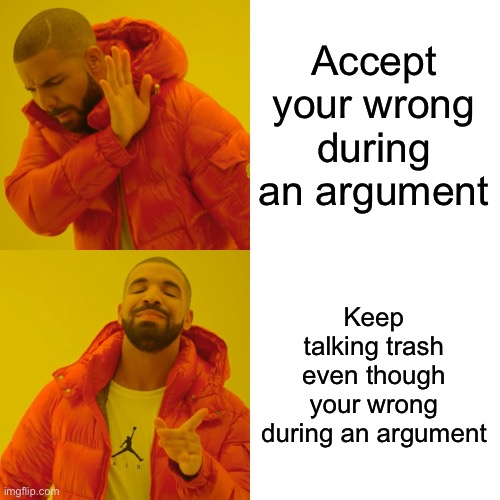
Where is `hood`? The image size is (500, 500). hood is located at coordinates (210, 365), (156, 65).